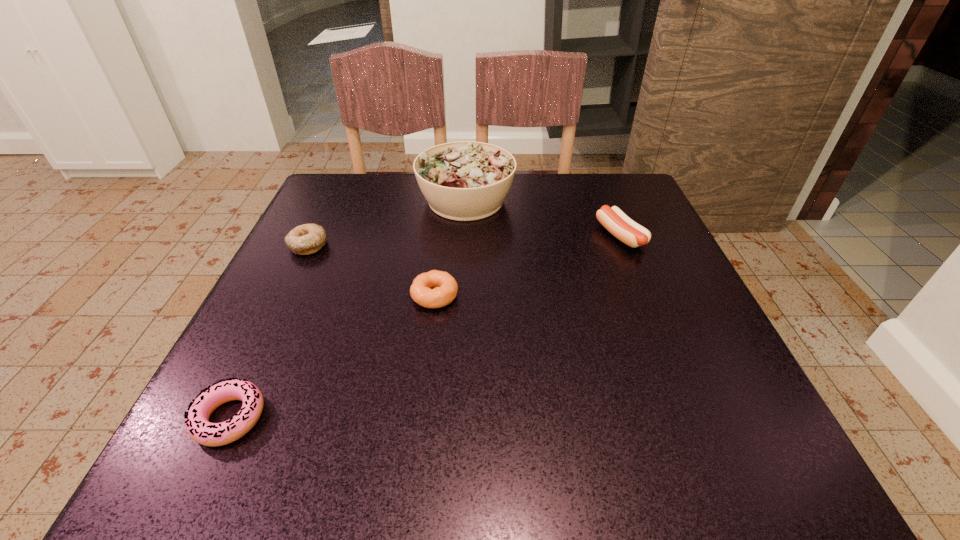
In order to click on free region at the far left corner in this screenshot , I will do `click(377, 190)`.

Identify the location of vacant region at the near left corner of the desktop. click(260, 427).

Where is `vacant space at the far right corner of the desktop`? This screenshot has width=960, height=540. vacant space at the far right corner of the desktop is located at coordinates (573, 174).

Locate an element on the screen. The height and width of the screenshot is (540, 960). vacant point located between the farthest doughnut and the sausage is located at coordinates (464, 240).

Where is `free space between the sausage and the tallest object`? The width and height of the screenshot is (960, 540). free space between the sausage and the tallest object is located at coordinates (543, 218).

Where is `free spot between the farthest doughnut and the nearest doughnut`? This screenshot has width=960, height=540. free spot between the farthest doughnut and the nearest doughnut is located at coordinates (269, 332).

What are the coordinates of `unoccupied area between the nearest object and the rightmost object` in the screenshot? It's located at (425, 327).

At what (x,y) coordinates should I click in order to perform the action: click on vacant space that is in between the rightmost doughnut and the tallest object. Please return your answer as a coordinate pair (x, y). The width and height of the screenshot is (960, 540). Looking at the image, I should click on (450, 248).

Locate an element on the screen. The height and width of the screenshot is (540, 960). vacant area that lies between the rightmost object and the salad is located at coordinates (543, 218).

This screenshot has height=540, width=960. What are the coordinates of `free space between the nearest doughnut and the sausage` in the screenshot? It's located at (425, 327).